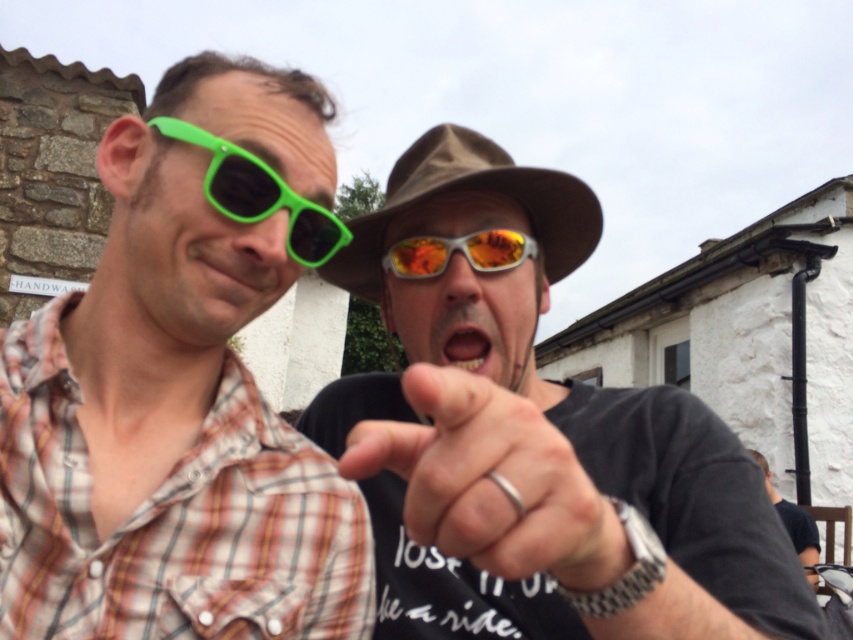
Question: Can you confirm if silver metallic ring at center is positioned to the right of green plastic sunglasses at left?

Choices:
 (A) no
 (B) yes

Answer: (B)

Question: Which point appears closest to the camera in this image?

Choices:
 (A) (437, 132)
 (B) (469, 352)
 (C) (271, 200)
 (D) (439, 458)

Answer: (D)

Question: Among these points, which one is nearest to the camera?

Choices:
 (A) (537, 216)
 (B) (460, 316)

Answer: (B)

Question: Is shiny metallic sunglasses at center positioned behind green plastic sunglasses at left?

Choices:
 (A) no
 (B) yes

Answer: (A)

Question: Which object is the farthest from the shiny metallic sunglasses at center?

Choices:
 (A) silver metallic ring at center
 (B) brown fabric fedora at center

Answer: (B)

Question: Is brown fabric fedora at center to the left of yellow glossy teeth at center from the viewer's perspective?

Choices:
 (A) no
 (B) yes

Answer: (B)